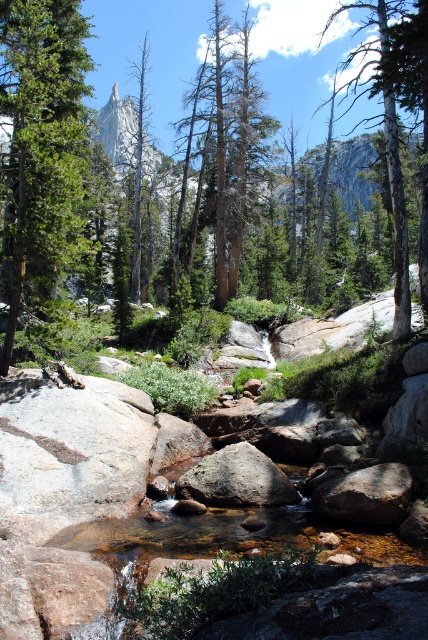
You are standing at the edge of the stream and see two points marked in the image. Which point is closer to you, point (91, 196) or point (74, 76)?

Point (91, 196) is closer to you because it is further to the viewer than point (74, 76).

You are a hiker who wants to cross the stream using the rocks and wood in the scene. The smooth gray rock at center is your starting point. Can you safely step onto the dead wood at center without getting wet? Explain why or why not based on the distance between them.

The smooth gray rock at center is 131.70 feet away from the dead wood at center. Since the distance is too large to jump across, stepping onto the dead wood at center from the smooth gray rock at center would result in getting wet.

Based on the photo, you are a hiker who wants to cross the stream using the rocks. You see the green mossy rock at center and the dead wood at center. Which object should you step on first to start your crossing?

You should step on the dead wood at center first because the green mossy rock at center is positioned to its right side, making the dead wood the closer starting point.